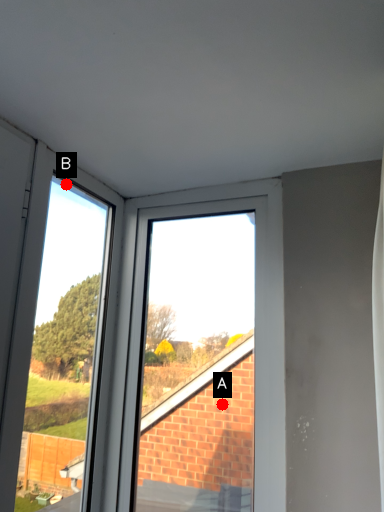
Question: Two points are circled on the image, labeled by A and B beside each circle. Among these points, which one is nearest to the camera?

Choices:
 (A) A is closer
 (B) B is closer

Answer: (B)